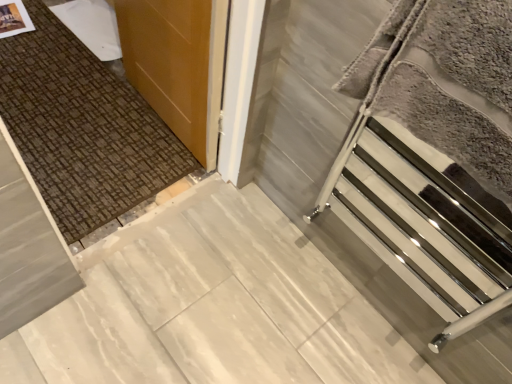
Locate an element on the screen. The height and width of the screenshot is (384, 512). free spot below silver metallic towel rack at right (from a real-world perspective) is located at coordinates (315, 294).